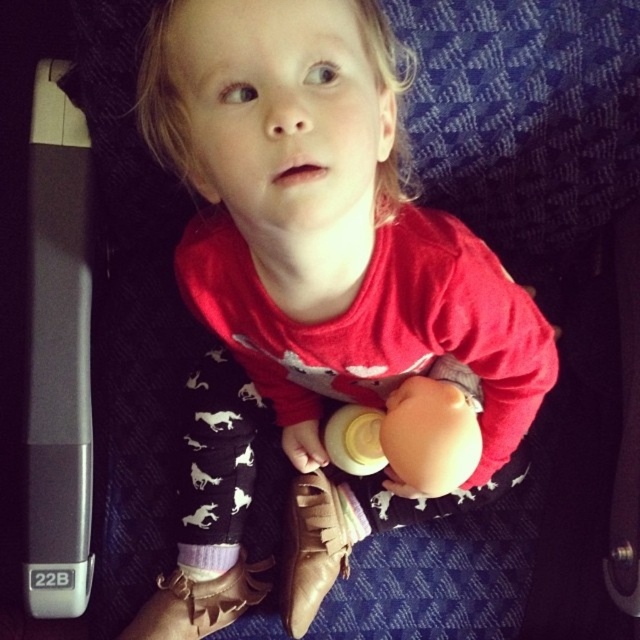
You are a flight attendant on an airplane. You need to check if the pink suede shoe at lower center is within reach for the child seated in seat 22B. The child can comfortably reach up to 36 inches. Is the shoe within the child reach?

The pink suede shoe at lower center is 36.64 inches away from the viewer. Since the child can only reach up to 36 inches, the shoe is slightly out of reach.

You are a flight attendant on an airplane. You need to retrieve the white plastic bottle at center from the child. However, the pink suede shoe at lower center is blocking access to it. Can you move the shoe to get the bottle?

The pink suede shoe at lower center is positioned under the white plastic bottle at center, so moving the shoe would require lifting the bottle first, making it difficult to access the bottle without disturbing both items.

You are a flight attendant checking the overhead compartment space. The overhead compartment has a width of 40 cm. You see the leather shoe at center and the white plastic bottle at center in the luggage. Can both items fit side by side in the compartment?

The leather shoe at center might be wider than white plastic bottle at center. Since the width of the overhead compartment is 40 cm, it is uncertain if both items can fit side by side without overlapping. Please check the actual dimensions of both items before deciding.